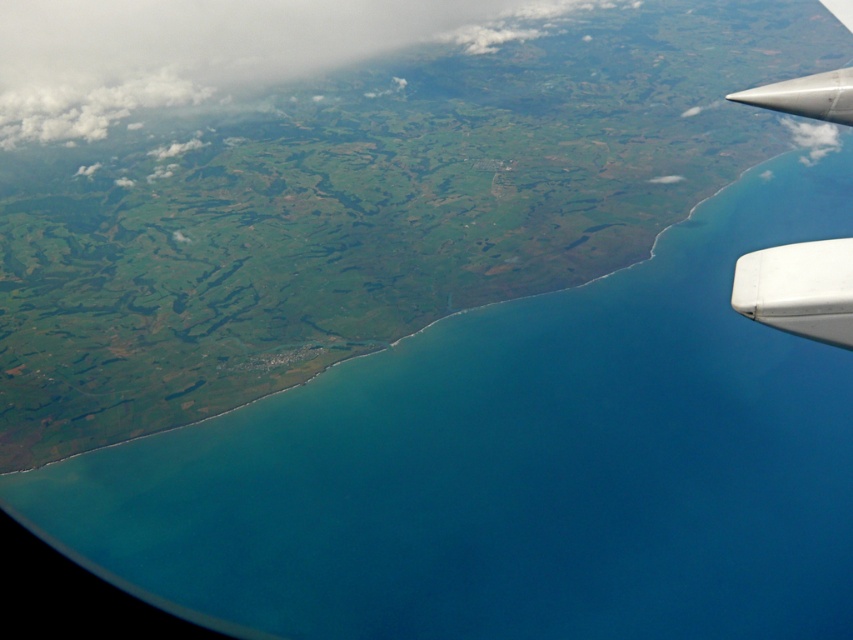
Based on the photo, you are a passenger on an airplane and notice two parts of the aircraft through the window. The silver metallic winglet at upper right and the white matte wing at lower right. Which one appears taller from your viewpoint?

The silver metallic winglet at upper right appears taller than the white matte wing at lower right from your viewpoint.

You are a pilot flying over the coastal area and notice two points marked on your map. The first point is at coordinate point [822,337] and the second is at point [744,269]. Which point is closer to your current altitude?

Point [822,337] is closer to the camera than point [744,269], so the first point is closer to your current altitude.

You are a passenger sitting by the window on an airplane. You see the white fluffy cloud at upper left and the silver metallic winglet at upper right. Which object is closer to the left side of your view?

The white fluffy cloud at upper left is positioned on the left side of the silver metallic winglet at upper right, so it is closer to the left side of your view.